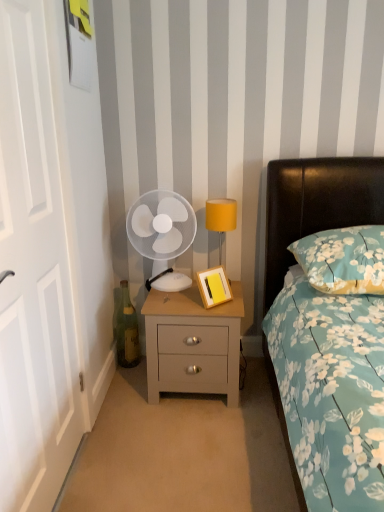
Question: From the image's perspective, is wooden picture frame at bedside table on top of floral fabric pillow at right?

Choices:
 (A) no
 (B) yes

Answer: (A)

Question: Can you confirm if wooden picture frame at bedside table is taller than floral fabric pillow at right?

Choices:
 (A) no
 (B) yes

Answer: (A)

Question: Does wooden picture frame at bedside table lie behind floral fabric pillow at right?

Choices:
 (A) yes
 (B) no

Answer: (A)

Question: Does wooden picture frame at bedside table turn towards floral fabric pillow at right?

Choices:
 (A) yes
 (B) no

Answer: (B)

Question: Is wooden picture frame at bedside table beside floral fabric pillow at right?

Choices:
 (A) no
 (B) yes

Answer: (A)

Question: Is yellow fabric lampshade at upper right situated inside green glass bottle at lower left or outside?

Choices:
 (A) outside
 (B) inside

Answer: (A)

Question: Considering the positions of yellow fabric lampshade at upper right and green glass bottle at lower left in the image, is yellow fabric lampshade at upper right wider or thinner than green glass bottle at lower left?

Choices:
 (A) thin
 (B) wide

Answer: (B)

Question: From a real-world perspective, is yellow fabric lampshade at upper right physically located above or below green glass bottle at lower left?

Choices:
 (A) above
 (B) below

Answer: (A)

Question: Considering the positions of yellow fabric lampshade at upper right and green glass bottle at lower left in the image, is yellow fabric lampshade at upper right taller or shorter than green glass bottle at lower left?

Choices:
 (A) short
 (B) tall

Answer: (A)

Question: Looking at the image, does yellow fabric lampshade at upper right seem bigger or smaller compared to white wooden door at left?

Choices:
 (A) small
 (B) big

Answer: (A)

Question: Considering the relative positions of yellow fabric lampshade at upper right and white wooden door at left in the image provided, is yellow fabric lampshade at upper right to the left or to the right of white wooden door at left?

Choices:
 (A) right
 (B) left

Answer: (A)

Question: Considering the positions of yellow fabric lampshade at upper right and white wooden door at left in the image, is yellow fabric lampshade at upper right wider or thinner than white wooden door at left?

Choices:
 (A) wide
 (B) thin

Answer: (A)

Question: Relative to white wooden door at left, is yellow fabric lampshade at upper right in front or behind?

Choices:
 (A) behind
 (B) front

Answer: (A)

Question: Is white plastic fan at center in front of or behind teal floral fabric bed at right in the image?

Choices:
 (A) front
 (B) behind

Answer: (B)

Question: In terms of height, does white plastic fan at center look taller or shorter compared to teal floral fabric bed at right?

Choices:
 (A) short
 (B) tall

Answer: (A)